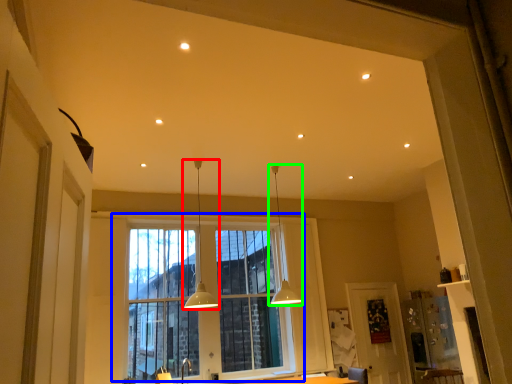
Question: Considering the real-world distances, which object is closest to lamp (highlighted by a red box)? window (highlighted by a blue box) or lamp (highlighted by a green box).

Choices:
 (A) window
 (B) lamp

Answer: (A)